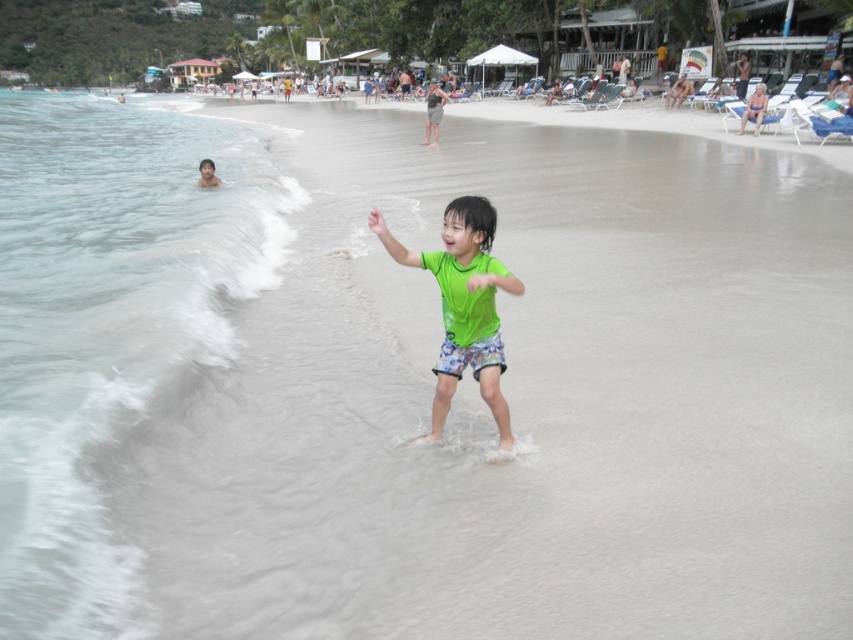
Between clear water at left and green matte swimsuit at center, which one is positioned higher?

Positioned higher is clear water at left.

Is clear water at left thinner than green matte swimsuit at center?

No.

Who is more distant from viewer, (213, 362) or (489, 260)?

The point (213, 362) is more distant.

Where is `clear water at left`? clear water at left is located at coordinates (109, 324).